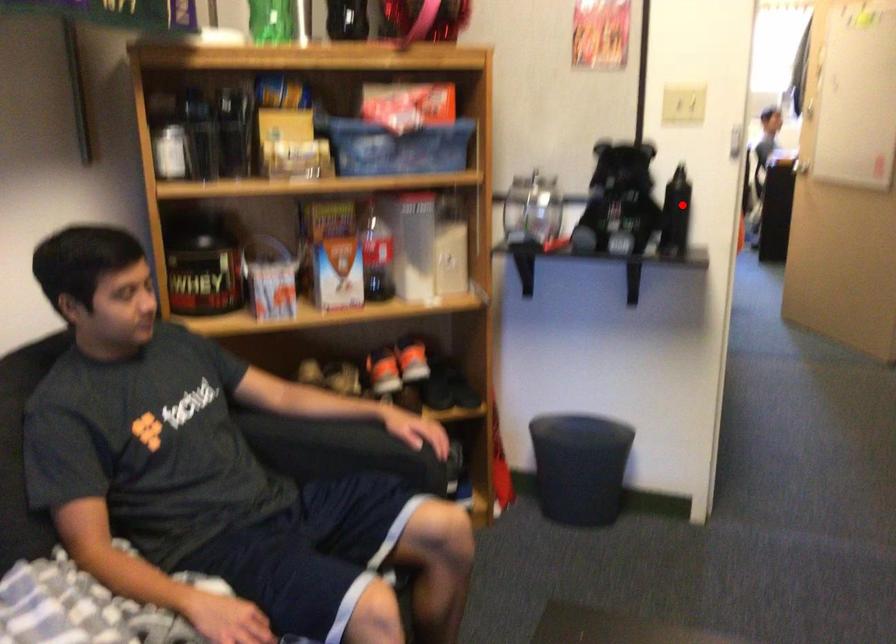
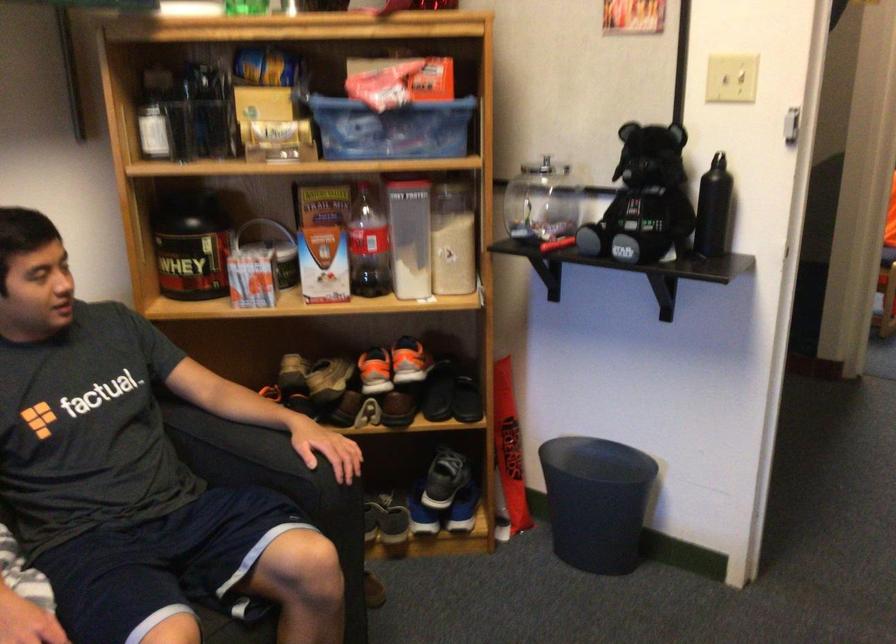
Locate, in the second image, the point that corresponds to the highlighted location in the first image.

(712, 209)